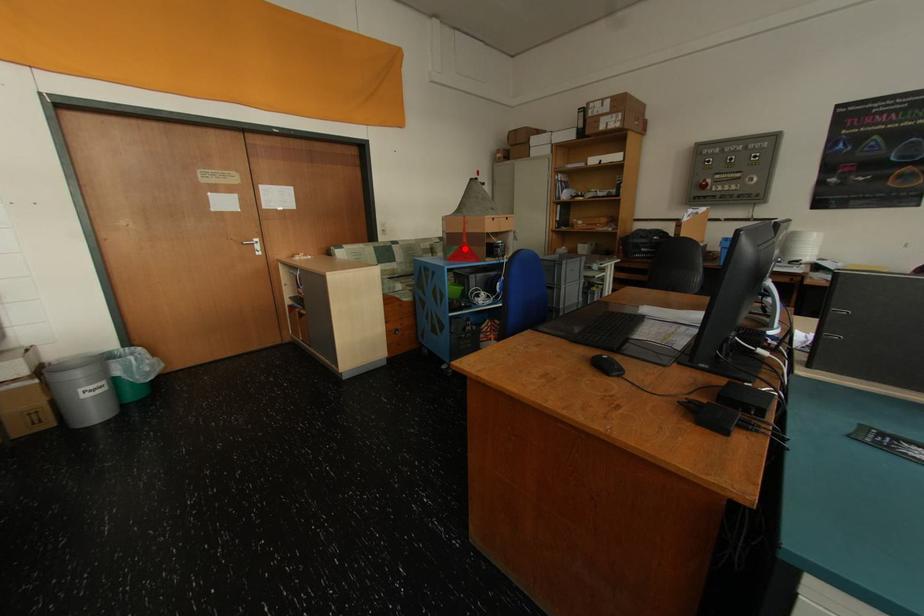
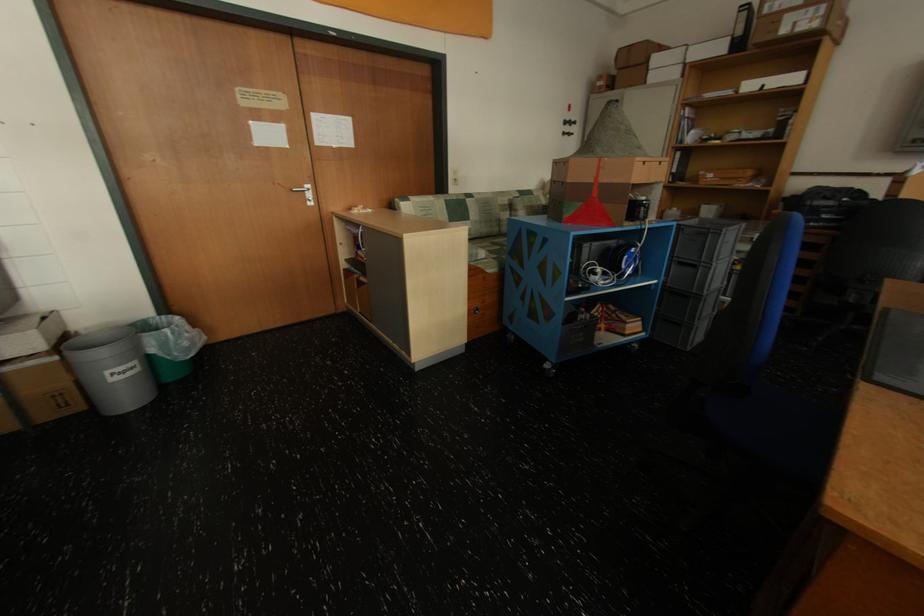
Question: I am providing you with two images of the same scene from different viewpoints. Image1 has a red point marked. In image2, the corresponding 3D location appears at what relative position? Reply with the corresponding letter.

Choices:
 (A) Closer
 (B) Farther

Answer: (B)